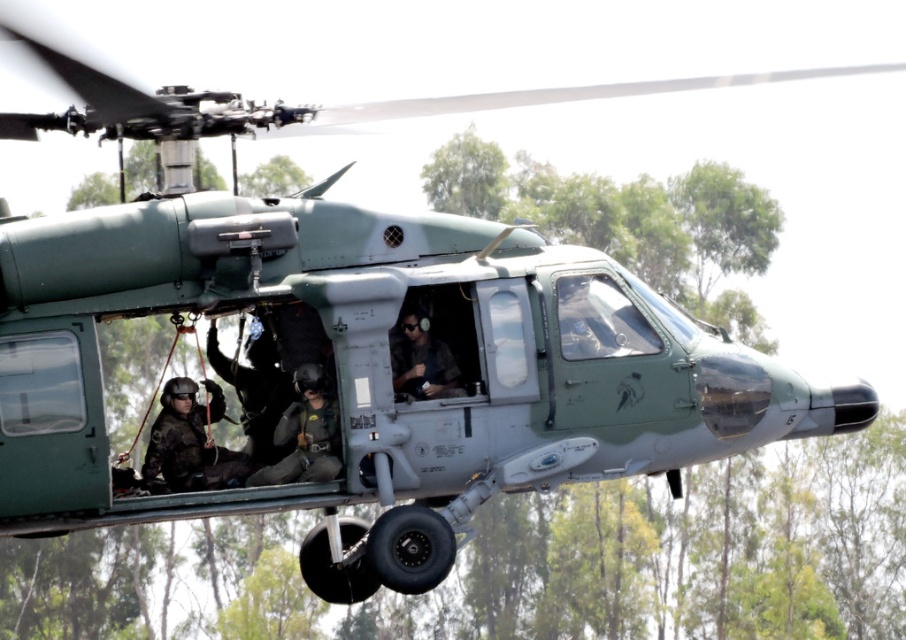
Question: Does black tactical vest at center lie in front of matte black helmet at center?

Choices:
 (A) yes
 (B) no

Answer: (B)

Question: Which point is farther to the camera?

Choices:
 (A) camouflage fabric helmet at center
 (B) black tactical vest at center
 (C) matte black helmet at center

Answer: (B)

Question: Can you confirm if black tactical vest at center is positioned below matte black helmet at center?

Choices:
 (A) yes
 (B) no

Answer: (A)

Question: Which point appears closest to the camera in this image?

Choices:
 (A) pyautogui.click(x=444, y=392)
 (B) pyautogui.click(x=211, y=410)

Answer: (A)

Question: Considering the relative positions of black tactical vest at center and matte black helmet at center in the image provided, where is black tactical vest at center located with respect to matte black helmet at center?

Choices:
 (A) below
 (B) above

Answer: (A)

Question: Which point is farther to the camera?

Choices:
 (A) (331, 476)
 (B) (169, 394)
 (C) (445, 348)

Answer: (B)